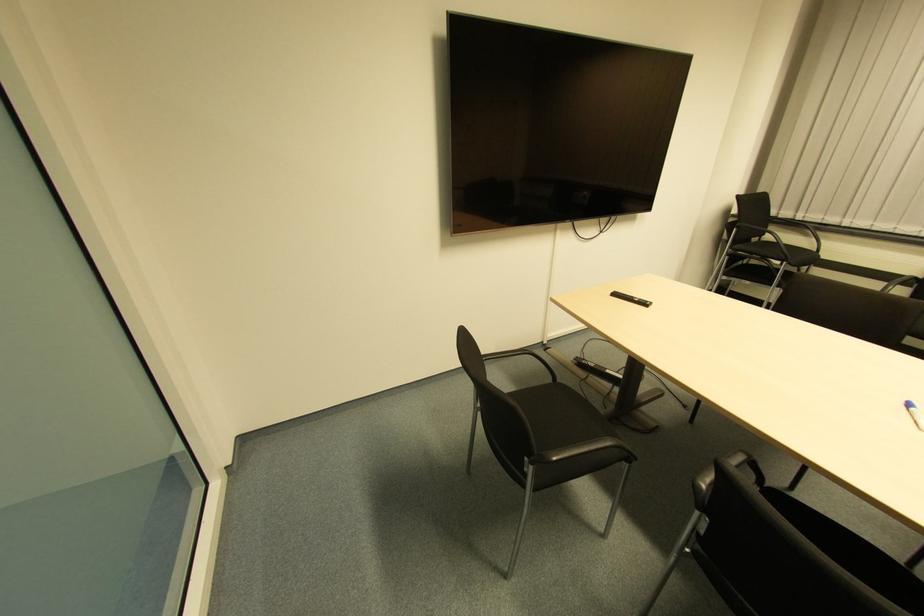
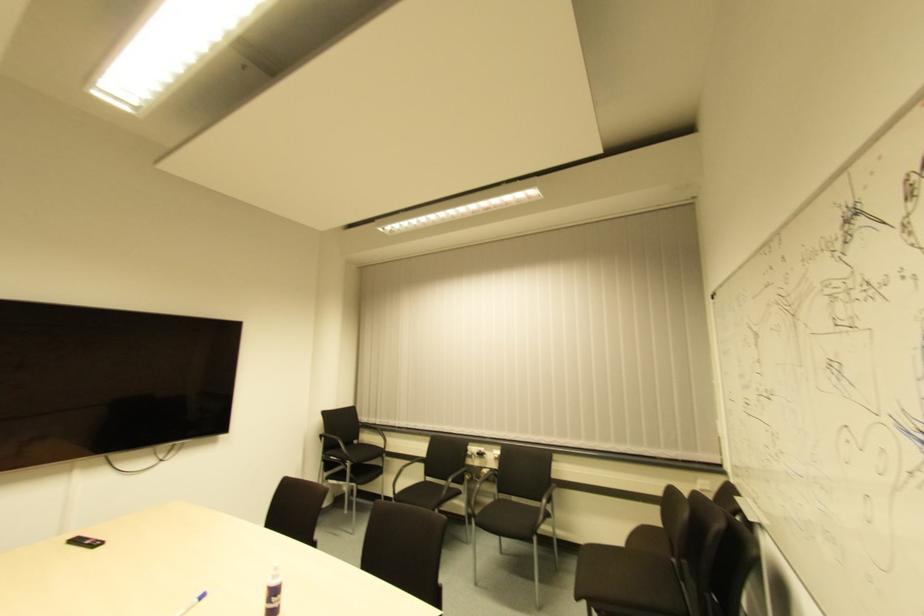
In the second image, find the point that corresponds to (x=614, y=298) in the first image.

(73, 543)